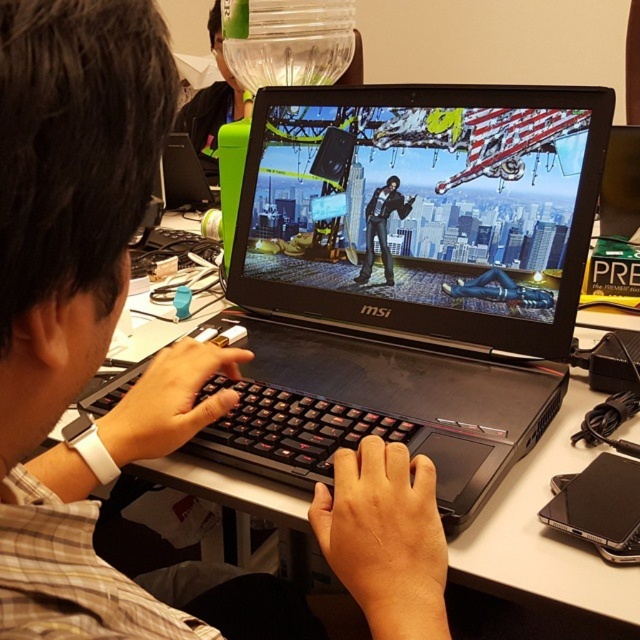
Can you confirm if black matte keyboard at center is taller than white plastic table at center?

Indeed, black matte keyboard at center has a greater height compared to white plastic table at center.

Does point (45, 186) lie behind point (509, 481)?

No.

The image size is (640, 640). Identify the location of black matte keyboard at center. (92, 324).

Is white plastic table at center positioned at the back of black matte jacket at center?

No, it is in front of black matte jacket at center.

Between white plastic table at center and black matte jacket at center, which one has more height?

With more height is white plastic table at center.

At what (x,y) coordinates should I click in order to perform the action: click on white plastic table at center. Please return your answer as a coordinate pair (x, y). The image size is (640, 640). Looking at the image, I should click on (545, 538).

The height and width of the screenshot is (640, 640). Find the location of `shiny black laptop at center`. shiny black laptop at center is located at coordinates (422, 209).

Who is more distant from viewer, (x=348, y=285) or (x=221, y=58)?

Point (x=221, y=58)

This screenshot has width=640, height=640. What are the coordinates of `shiny black laptop at center` in the screenshot? It's located at coord(422,209).